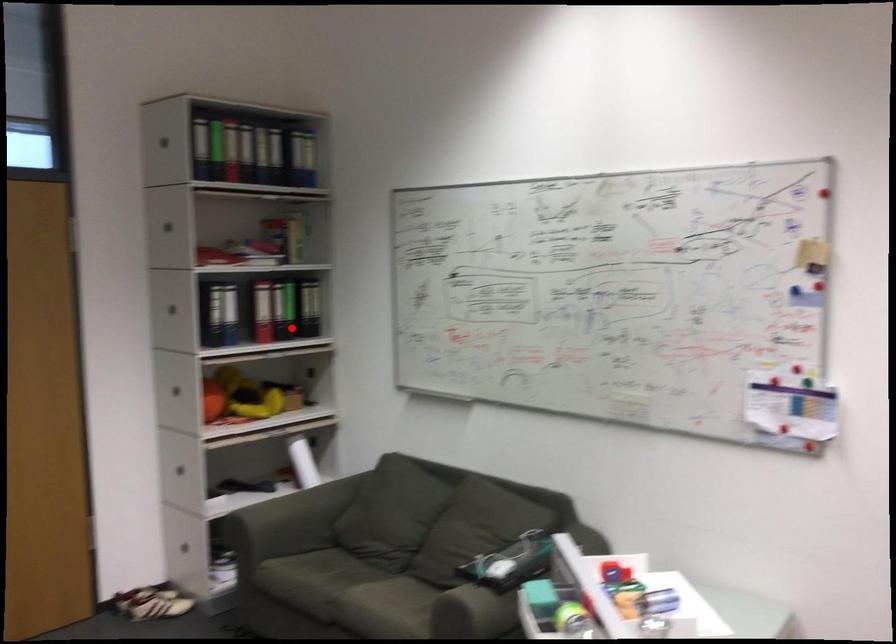
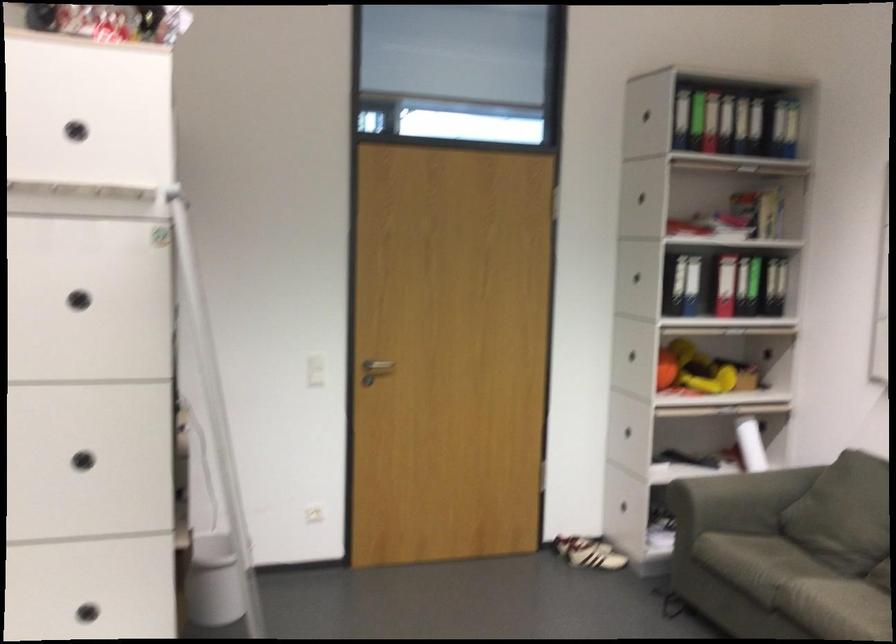
The point at the highlighted location is marked in the first image. Where is the corresponding point in the second image?

(757, 285)